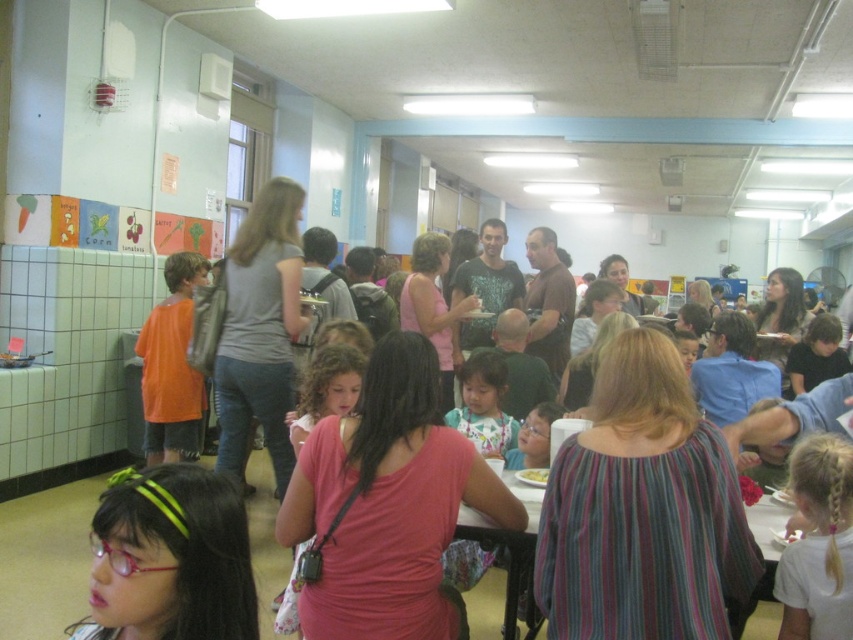
Can you confirm if white cotton shirt at lower right is positioned to the right of light brown hair at center?

Indeed, white cotton shirt at lower right is positioned on the right side of light brown hair at center.

Does point (819, 550) come farther from viewer compared to point (463, 424)?

No, it is in front of (463, 424).

The width and height of the screenshot is (853, 640). Describe the element at coordinates (817, 544) in the screenshot. I see `white cotton shirt at lower right` at that location.

At what (x,y) coordinates should I click in order to perform the action: click on white cotton shirt at lower right. Please return your answer as a coordinate pair (x, y). Looking at the image, I should click on (817, 544).

Who is higher up, white cotton shirt at lower right or orange matte shirt at left?

orange matte shirt at left is higher up.

The height and width of the screenshot is (640, 853). Describe the element at coordinates (817, 544) in the screenshot. I see `white cotton shirt at lower right` at that location.

You are a GUI agent. You are given a task and a screenshot of the screen. Output one action in this format:
    pyautogui.click(x=<x>, y=<y>)
    Task: Click on the white cotton shirt at lower right
    Image resolution: width=853 pixels, height=640 pixels.
    Given the screenshot: What is the action you would take?
    pyautogui.click(x=817, y=544)

Based on the photo, is dark green t-shirt at center above white matte plate at center?

Indeed, dark green t-shirt at center is positioned over white matte plate at center.

Is dark green t-shirt at center wider than white matte plate at center?

Yes, dark green t-shirt at center is wider than white matte plate at center.

What do you see at coordinates (486, 284) in the screenshot?
I see `dark green t-shirt at center` at bounding box center [486, 284].

The image size is (853, 640). In order to click on dark green t-shirt at center in this screenshot , I will do `click(486, 284)`.